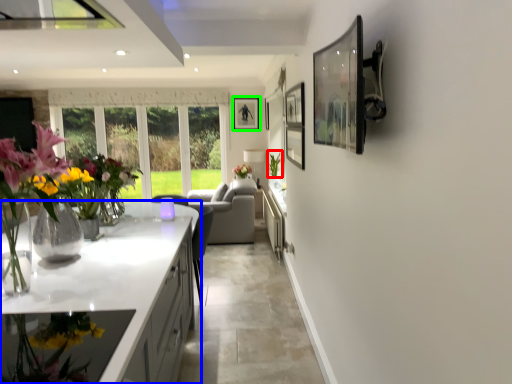
Question: Estimate the real-world distances between objects in this image. Which object is farther from plant (highlighted by a red box), countertop (highlighted by a blue box) or picture frame (highlighted by a green box)?

Choices:
 (A) countertop
 (B) picture frame

Answer: (A)